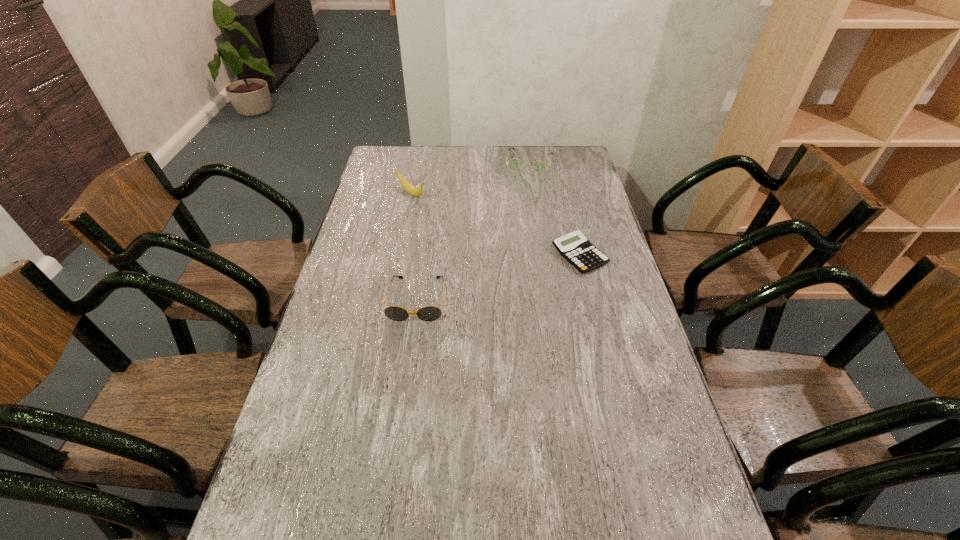
Find the location of a particular element. The height and width of the screenshot is (540, 960). vacant point located between the farthest object and the second farthest object is located at coordinates [470, 178].

You are a GUI agent. You are given a task and a screenshot of the screen. Output one action in this format:
    pyautogui.click(x=<x>, y=<y>)
    Task: Click on the vacant area that lies between the third nearest object and the farthest object
    The image size is (960, 540).
    Given the screenshot: What is the action you would take?
    pyautogui.click(x=470, y=178)

At what (x,y) coordinates should I click in order to perform the action: click on vacant space that's between the third nearest object and the calculator. Please return your answer as a coordinate pair (x, y). The width and height of the screenshot is (960, 540). Looking at the image, I should click on (495, 225).

Find the location of a particular element. This screenshot has height=540, width=960. free space between the farthest object and the tallest object is located at coordinates (470, 178).

At what (x,y) coordinates should I click in order to perform the action: click on the closest object to the nearest object. Please return your answer as a coordinate pair (x, y). The width and height of the screenshot is (960, 540). Looking at the image, I should click on (574, 247).

Identify which object is located as the second nearest to the shortest object. Please provide its 2D coordinates. Your answer should be formatted as a tuple, i.e. [(x, y)], where the tuple contains the x and y coordinates of a point satisfying the conditions above.

[(515, 165)]

Where is `free point that satisfies the following two spatial constraints: 1. on the front side of the spectacles; 2. on the right side of the calculator`? Image resolution: width=960 pixels, height=540 pixels. free point that satisfies the following two spatial constraints: 1. on the front side of the spectacles; 2. on the right side of the calculator is located at coordinates (543, 255).